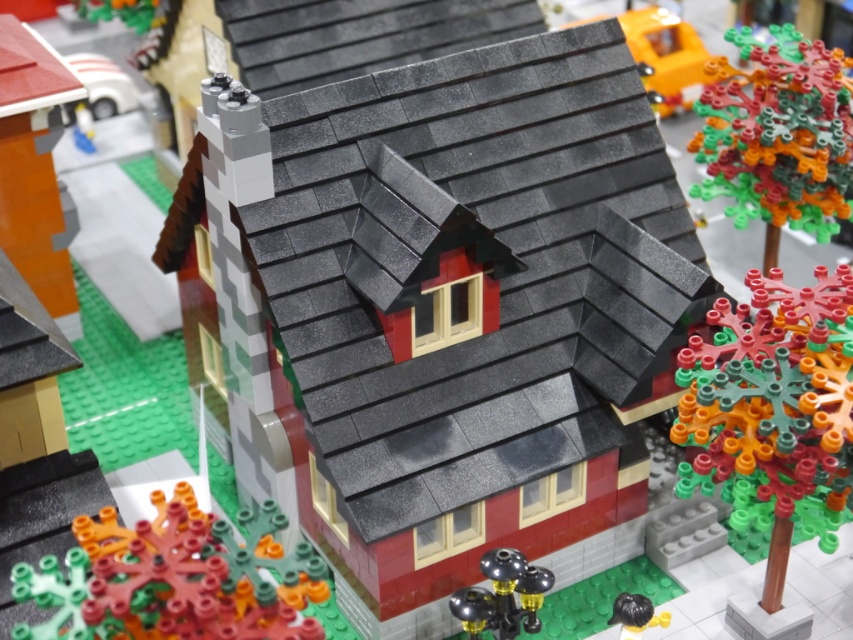
You are standing in the Lego model scene and want to place a new Lego tree between the smooth red brick house at center and the black rubber hair at lower right. Based on their positions, which side of the house should the tree be placed?

The smooth red brick house at center is to the left of the black rubber hair at lower right, so the new Lego tree should be placed to the right side of the smooth red brick house at center to position it between them.

You are a tiny explorer standing on the green Lego baseplate. You see the translucent orange coral at lower left and the multicolored plastic tree at upper right. Which object is closer to the ground?

The translucent orange coral at lower left is positioned under the multicolored plastic tree at upper right, so it is closer to the ground.

You are a tiny Lego figure standing on the green Lego baseplate. You want to reach the multicolored plastic tree at right from the translucent orange coral at lower left. Which direction should you move first?

The multicolored plastic tree at right is positioned over the translucent orange coral at lower left, so you are already at the correct location. No movement is needed.